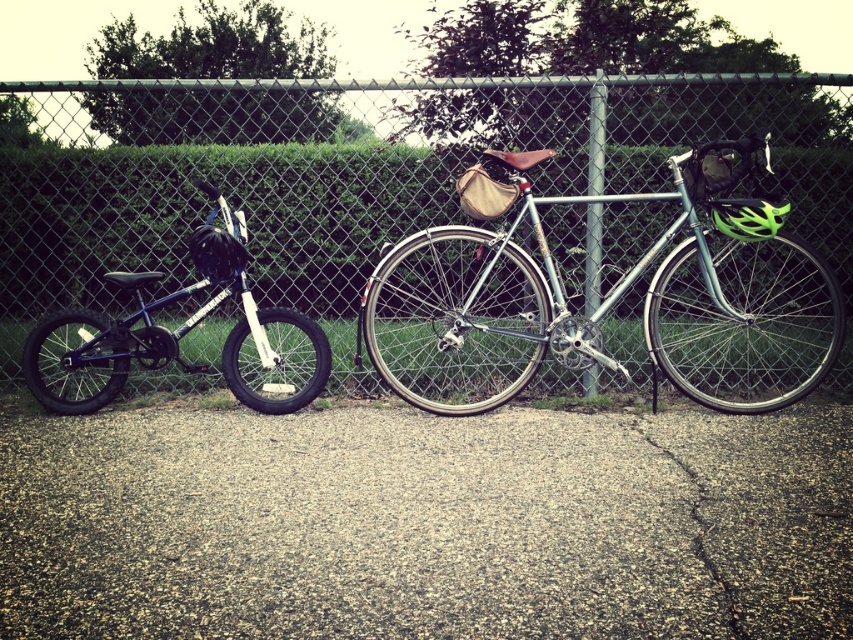
Question: Does green chain-link fence at center appear under shiny blue bicycle at left?

Choices:
 (A) no
 (B) yes

Answer: (A)

Question: Observing the image, what is the correct spatial positioning of green chain-link fence at center in reference to shiny blue bicycle at left?

Choices:
 (A) above
 (B) below

Answer: (A)

Question: Considering the real-world distances, which object is closest to the silver metallic bicycle at center?

Choices:
 (A) green chain-link fence at center
 (B) shiny blue bicycle at left

Answer: (B)

Question: Which object is closer to the camera taking this photo?

Choices:
 (A) shiny blue bicycle at left
 (B) silver metallic bicycle at center

Answer: (B)

Question: Is the position of green chain-link fence at center more distant than that of silver metallic bicycle at center?

Choices:
 (A) no
 (B) yes

Answer: (B)

Question: Among these points, which one is nearest to the camera?

Choices:
 (A) (10, 196)
 (B) (688, 205)
 (C) (254, 394)

Answer: (B)